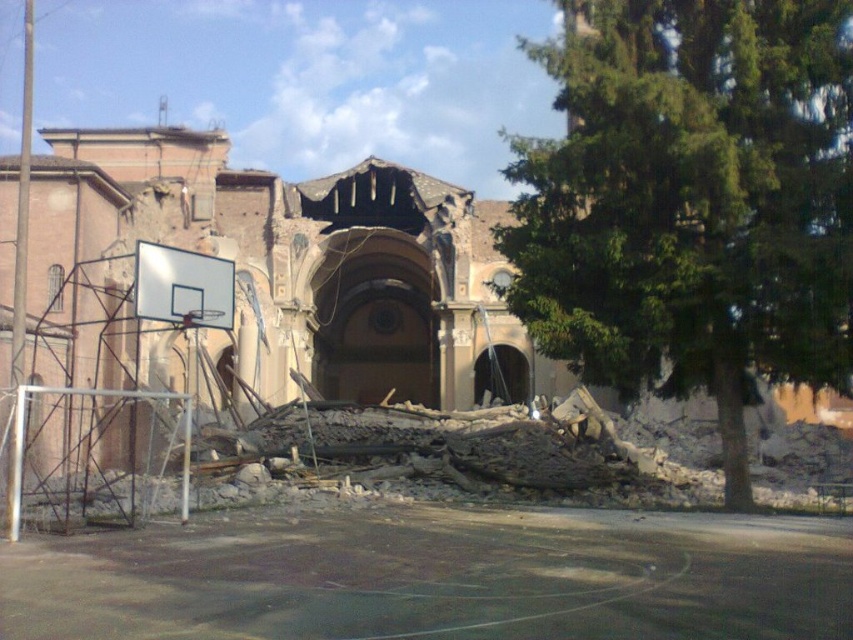
You are standing near the green leafy tree at center and want to walk to the smooth asphalt basketball court at lower center. Which direction should you move to get closer to the basketball court?

You should move forward because the green leafy tree at center is further to the viewer than the smooth asphalt basketball court at lower center, meaning the basketball court is closer to you and in front of the tree.

You are planning to plant a new tree in the area. The existing green leafy tree at center is narrower than the smooth asphalt basketball court at lower center. Considering the space available, which object would require more horizontal space if you want to plant a larger tree?

The smooth asphalt basketball court at lower center requires more horizontal space because it is wider than the green leafy tree at center.

You are standing at the point labeled as point (692,200) in the image. What do you see directly in front of you?

You see a green leafy tree at center directly in front of you at point (692,200).